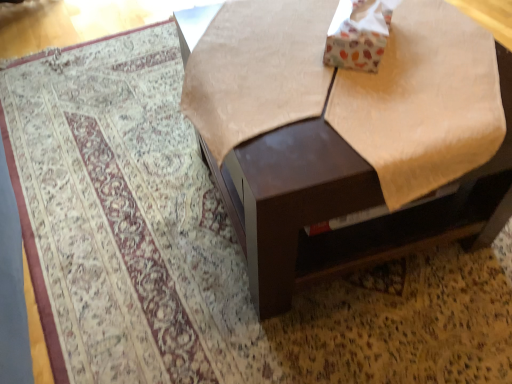
Question: Is white cardboard box at upper right inside brown glossy table at upper center?

Choices:
 (A) no
 (B) yes

Answer: (B)

Question: Is brown glossy table at upper center further to camera compared to white cardboard box at upper right?

Choices:
 (A) yes
 (B) no

Answer: (B)

Question: From the image's perspective, is brown glossy table at upper center on white cardboard box at upper right?

Choices:
 (A) no
 (B) yes

Answer: (A)

Question: Is brown glossy table at upper center far from white cardboard box at upper right?

Choices:
 (A) yes
 (B) no

Answer: (B)

Question: Is brown glossy table at upper center oriented towards white cardboard box at upper right?

Choices:
 (A) yes
 (B) no

Answer: (B)

Question: From a real-world perspective, is brown glossy table at upper center under white cardboard box at upper right?

Choices:
 (A) yes
 (B) no

Answer: (A)

Question: Can you confirm if white cardboard box at upper right is bigger than brown glossy table at upper center?

Choices:
 (A) no
 (B) yes

Answer: (A)

Question: Is white cardboard box at upper right completely or partially outside of brown glossy table at upper center?

Choices:
 (A) yes
 (B) no

Answer: (B)

Question: Does white cardboard box at upper right have a smaller size compared to brown glossy table at upper center?

Choices:
 (A) no
 (B) yes

Answer: (B)

Question: From the image's perspective, is white cardboard box at upper right located above brown glossy table at upper center?

Choices:
 (A) no
 (B) yes

Answer: (B)

Question: From the image's perspective, is white cardboard box at upper right beneath brown glossy table at upper center?

Choices:
 (A) no
 (B) yes

Answer: (A)

Question: Is brown glossy table at upper center at the back of white cardboard box at upper right?

Choices:
 (A) yes
 (B) no

Answer: (A)

Question: Is point (494, 203) closer or farther from the camera than point (352, 49)?

Choices:
 (A) closer
 (B) farther

Answer: (B)